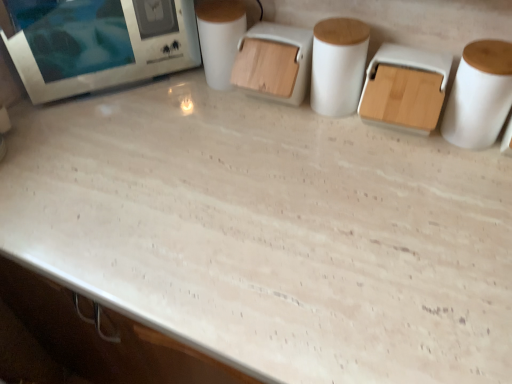
Question: From the image's perspective, would you say white matte toilet paper at center is shown under white matte paper towel at right, the 2th paper towel from the left?

Choices:
 (A) yes
 (B) no

Answer: (B)

Question: Can you confirm if white matte toilet paper at center is bigger than white matte paper towel at right, the 1th paper towel from the right?

Choices:
 (A) yes
 (B) no

Answer: (B)

Question: From the image's perspective, is white matte toilet paper at center on white matte paper towel at right, the 1th paper towel from the right?

Choices:
 (A) yes
 (B) no

Answer: (A)

Question: Is white matte toilet paper at center to the left of white matte paper towel at right, the 2th paper towel from the left, from the viewer's perspective?

Choices:
 (A) no
 (B) yes

Answer: (B)

Question: Considering the relative sizes of white matte toilet paper at center and white matte paper towel at right, the 2th paper towel from the left, in the image provided, is white matte toilet paper at center smaller than white matte paper towel at right, the 2th paper towel from the left,?

Choices:
 (A) yes
 (B) no

Answer: (A)

Question: From a real-world perspective, is wooden lid container at center above or below white matte paper towel at center, placed as the 1th paper towel when sorted from left to right?

Choices:
 (A) above
 (B) below

Answer: (B)

Question: From the image's perspective, is wooden lid container at center positioned above or below white matte paper towel at center, placed as the 1th paper towel when sorted from left to right?

Choices:
 (A) above
 (B) below

Answer: (A)

Question: In terms of size, does wooden lid container at center appear bigger or smaller than white matte paper towel at center, placed as the 1th paper towel when sorted from left to right?

Choices:
 (A) big
 (B) small

Answer: (A)

Question: Considering the relative positions of wooden lid container at center and white matte paper towel at center, which is counted as the second paper towel, starting from the right, in the image provided, is wooden lid container at center to the left or to the right of white matte paper towel at center, which is counted as the second paper towel, starting from the right,?

Choices:
 (A) right
 (B) left

Answer: (B)

Question: Looking at their shapes, would you say white matte paper towel at center, which is counted as the second paper towel, starting from the right, is wider or thinner than white matte toilet paper at center?

Choices:
 (A) wide
 (B) thin

Answer: (A)

Question: Considering the positions of point (346, 112) and point (222, 41), is point (346, 112) closer or farther from the camera than point (222, 41)?

Choices:
 (A) farther
 (B) closer

Answer: (B)

Question: Is white matte paper towel at center, which is counted as the second paper towel, starting from the right, taller or shorter than white matte toilet paper at center?

Choices:
 (A) tall
 (B) short

Answer: (B)

Question: Is white matte paper towel at center, which is counted as the second paper towel, starting from the right, bigger or smaller than white matte toilet paper at center?

Choices:
 (A) small
 (B) big

Answer: (B)

Question: Does point (295, 89) appear closer or farther from the camera than point (103, 31)?

Choices:
 (A) closer
 (B) farther

Answer: (A)

Question: Considering the positions of wooden lid container at center and white glossy microwave at upper left in the image, is wooden lid container at center taller or shorter than white glossy microwave at upper left?

Choices:
 (A) short
 (B) tall

Answer: (A)